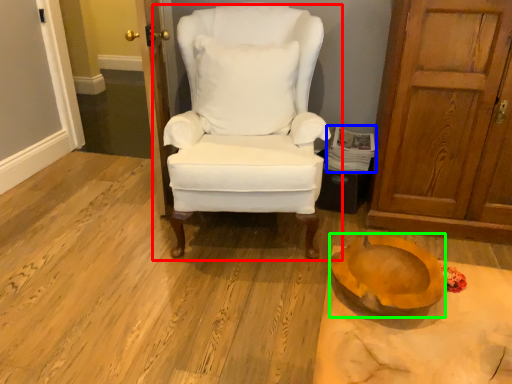
Question: Which object is the farthest from chair (highlighted by a red box)? Choose among these: magazine (highlighted by a blue box) or oval (highlighted by a green box).

Choices:
 (A) magazine
 (B) oval

Answer: (B)